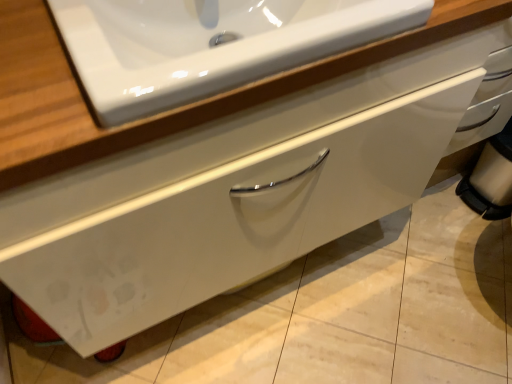
You are a GUI agent. You are given a task and a screenshot of the screen. Output one action in this format:
    pyautogui.click(x=<x>, y=<y>)
    Task: Click on the white glossy sink at upper center
    This screenshot has width=512, height=384.
    Given the screenshot: What is the action you would take?
    pyautogui.click(x=208, y=44)

The image size is (512, 384). What do you see at coordinates (208, 44) in the screenshot? I see `white glossy sink at upper center` at bounding box center [208, 44].

Find the location of `white glossy sink at upper center`. white glossy sink at upper center is located at coordinates (208, 44).